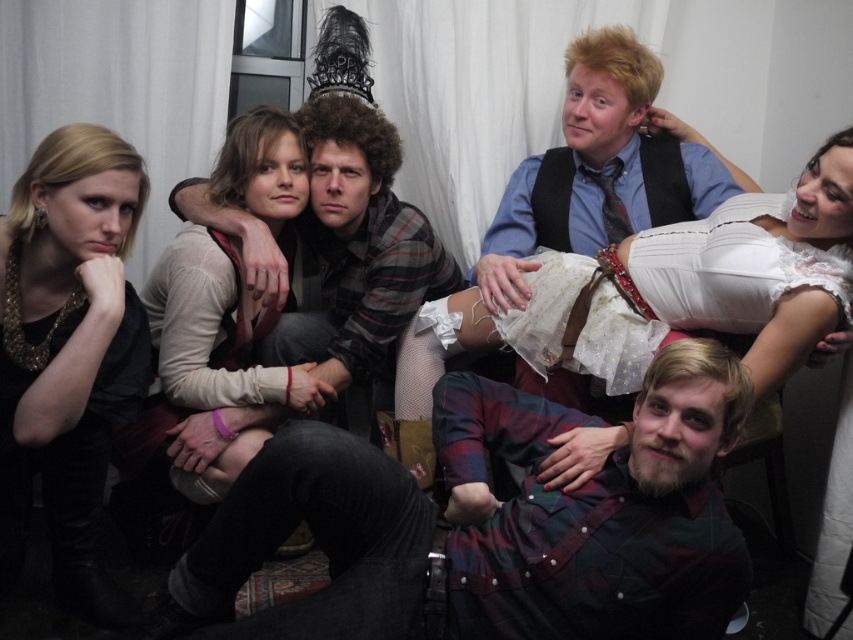
Question: Which point is farther to the camera?

Choices:
 (A) plaid flannel shirt at center
 (B) matte black shirt at left
 (C) blue shirt at upper right
 (D) flannel shirt at lower right

Answer: (A)

Question: Considering the relative positions of flannel shirt at lower right and blue shirt at upper right in the image provided, where is flannel shirt at lower right located with respect to blue shirt at upper right?

Choices:
 (A) left
 (B) right

Answer: (A)

Question: Which is farther from the matte black shirt at left?

Choices:
 (A) white lace dress at upper right
 (B) flannel shirt at lower right

Answer: (A)

Question: Which object is farther from the camera taking this photo?

Choices:
 (A) white lace dress at upper right
 (B) plaid flannel shirt at center

Answer: (B)

Question: Observing the image, what is the correct spatial positioning of flannel shirt at lower right in reference to plaid flannel shirt at center?

Choices:
 (A) below
 (B) above

Answer: (A)

Question: Is flannel shirt at lower right thinner than white lace dress at upper right?

Choices:
 (A) yes
 (B) no

Answer: (B)